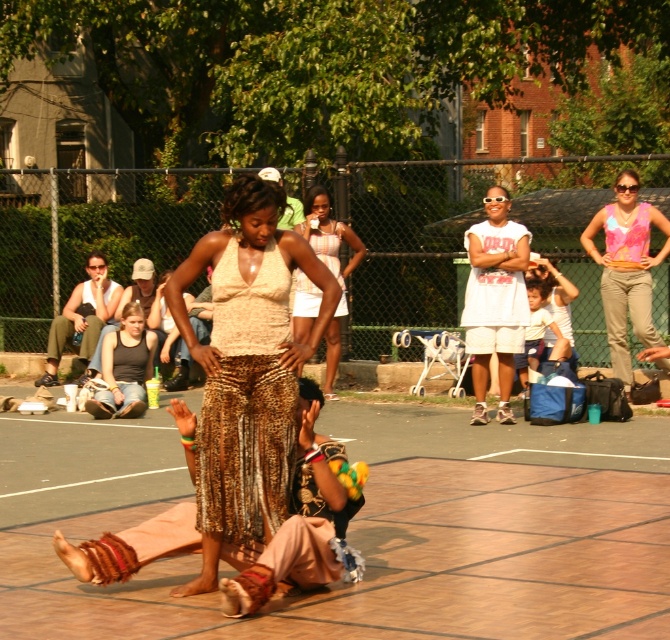
You are a photographer trying to capture a closeup of the two points in the image. Which point, point [269,529] or point [306,216], is closer to your camera lens?

Point [269,529] is closer to the camera lens than point [306,216].

You are a photographer trying to capture the scene. You want to place your camera at point [330,266] to get the best shot. What object will be directly under the camera?

The white cotton dress at center is located at point [330,266], so placing the camera there would position it directly over the white cotton dress at center.

In the scene shown: You are standing at the position of point (310, 326) and want to throw a ball to point (429, 556). Is the target point in front of you?

Yes, point (429, 556) is in front of point (310, 326), so the target is in front of you.